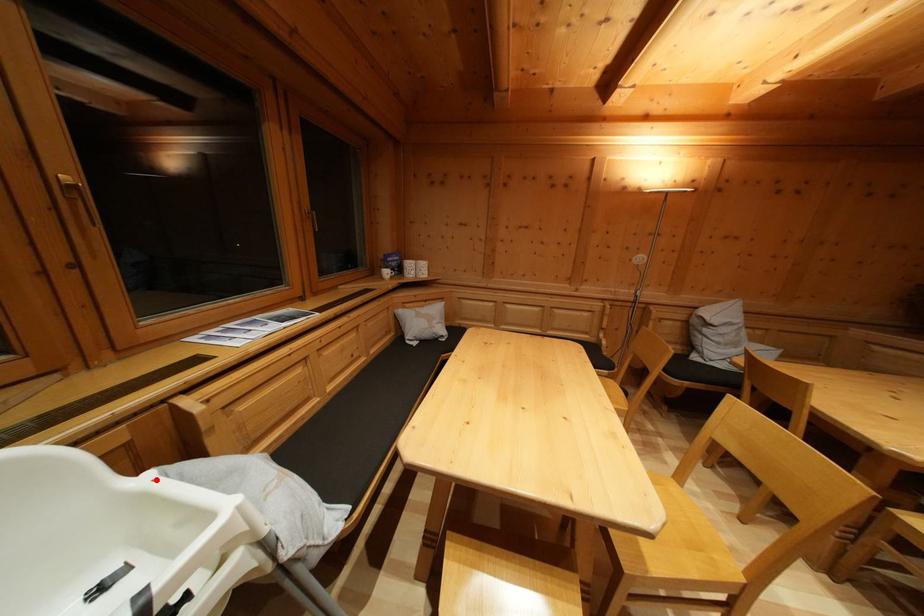
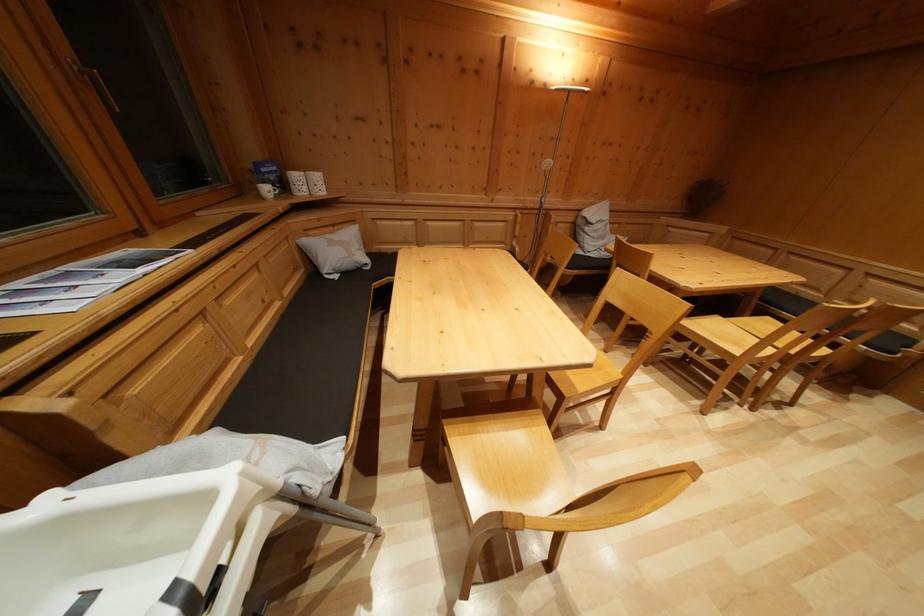
Locate, in the second image, the point that corresponds to the highlighted location in the first image.

(56, 503)